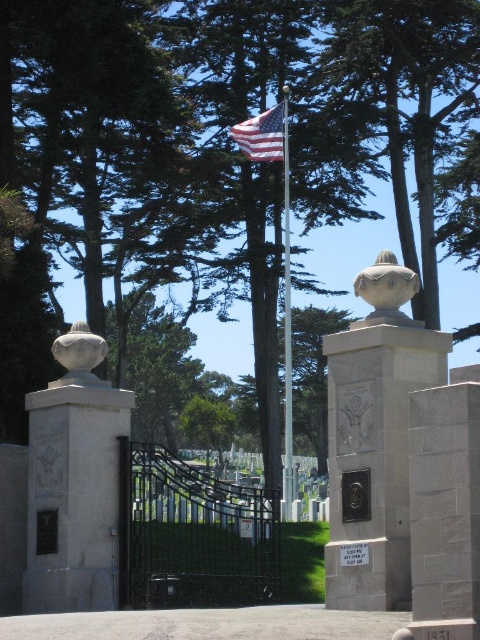
In the scene shown: Can you confirm if white stone urn at center is positioned below white stone sculpture at center?

Correct, white stone urn at center is located below white stone sculpture at center.

Between white stone urn at center and white stone sculpture at center, which one has less height?

white stone sculpture at center

The height and width of the screenshot is (640, 480). Identify the location of white stone urn at center. (73, 481).

Identify the location of white stone urn at center. Image resolution: width=480 pixels, height=640 pixels. (73, 481).

Based on the photo, is white stone urn at center smaller than matte bronze sculpture at center?

No, white stone urn at center is not smaller than matte bronze sculpture at center.

What do you see at coordinates (73, 481) in the screenshot? This screenshot has width=480, height=640. I see `white stone urn at center` at bounding box center [73, 481].

Describe the element at coordinates (73, 481) in the screenshot. The width and height of the screenshot is (480, 640). I see `white stone urn at center` at that location.

Locate an element on the screen. This screenshot has width=480, height=640. white stone urn at center is located at coordinates (73, 481).

Does white stone sculpture at center have a greater width compared to white stone sphere at left?

No.

Is white stone sculpture at center shorter than white stone sphere at left?

No, white stone sculpture at center is not shorter than white stone sphere at left.

Between point (402, 282) and point (84, 346), which one is positioned behind?

The point (84, 346) is more distant.

The image size is (480, 640). Find the location of `white stone sculpture at center`. white stone sculpture at center is located at coordinates (386, 289).